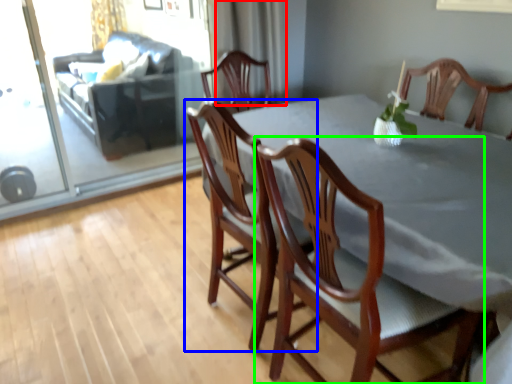
Question: Which is farther away from curtain (highlighted by a red box)? chair (highlighted by a blue box) or chair (highlighted by a green box)?

Choices:
 (A) chair
 (B) chair

Answer: (B)